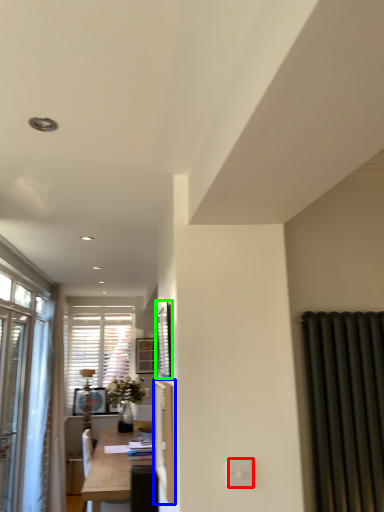
Question: Estimate the real-world distances between objects in this image. Which object is closer to electric outlet (highlighted by a red box), screen door (highlighted by a blue box) or window screen (highlighted by a green box)?

Choices:
 (A) screen door
 (B) window screen

Answer: (A)